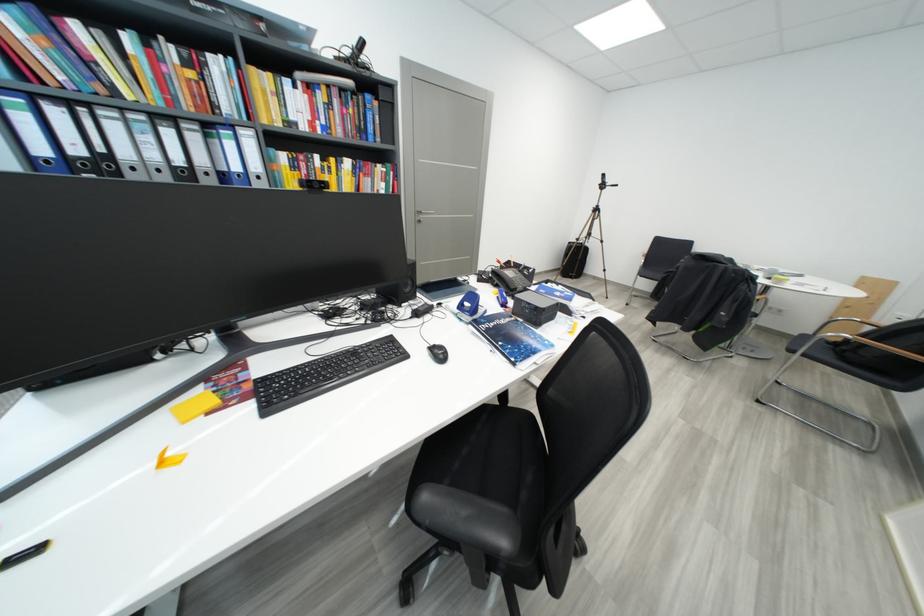
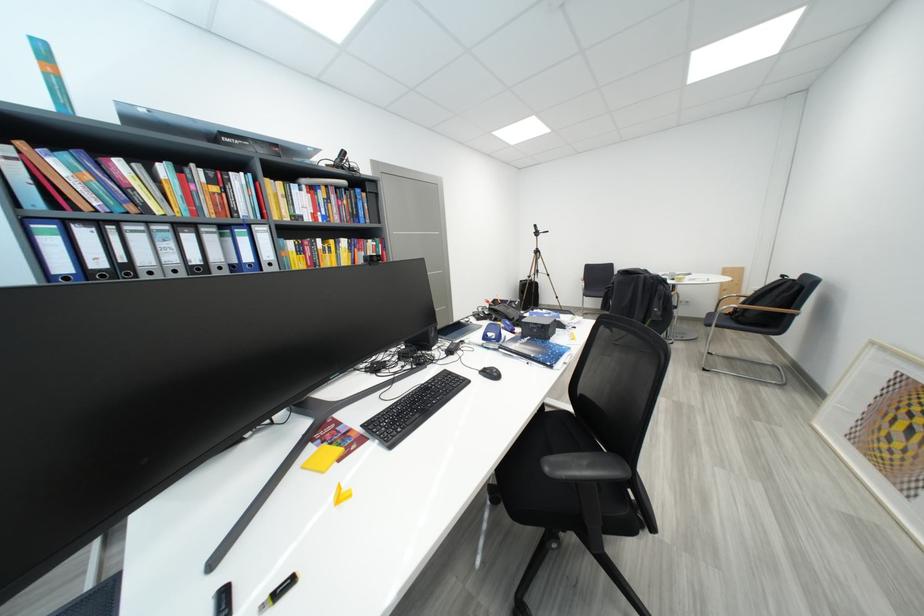
Question: The images are taken continuously from a first-person perspective. In which direction is your viewpoint rotating?

Choices:
 (A) Left
 (B) Right
 (C) Up
 (D) Down

Answer: (B)